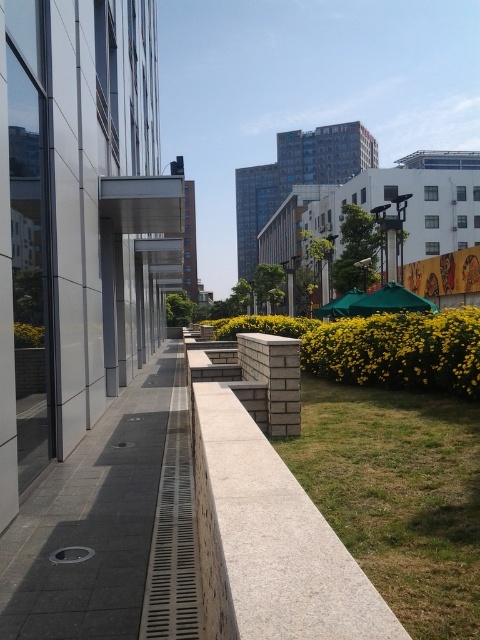
Question: Considering the real-world distances, which object is closest to the gray concrete pavement at center?

Choices:
 (A) gray stone ledge at center
 (B) green grass at lower right

Answer: (A)

Question: Is gray stone ledge at center positioned behind green grass at lower right?

Choices:
 (A) yes
 (B) no

Answer: (A)

Question: Does gray stone ledge at center lie behind green grass at lower right?

Choices:
 (A) no
 (B) yes

Answer: (B)

Question: Observing the image, what is the correct spatial positioning of gray stone ledge at center in reference to green grass at lower right?

Choices:
 (A) left
 (B) right

Answer: (A)

Question: Which object is closer to the camera taking this photo?

Choices:
 (A) gray stone ledge at center
 (B) green grass at lower right

Answer: (B)

Question: Estimate the real-world distances between objects in this image. Which object is closer to the gray stone ledge at center?

Choices:
 (A) gray concrete pavement at center
 (B) green grass at lower right

Answer: (B)